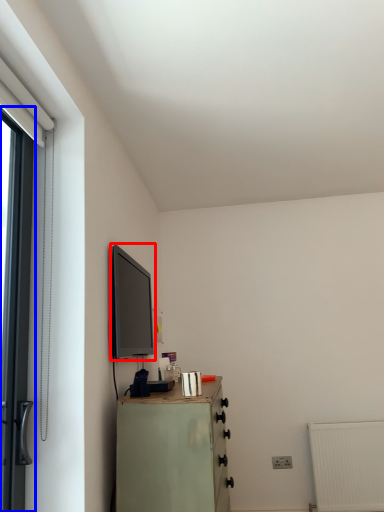
Question: Which point is closer to the camera, window screen (highlighted by a red box) or door (highlighted by a blue box)?

Choices:
 (A) window screen
 (B) door

Answer: (B)